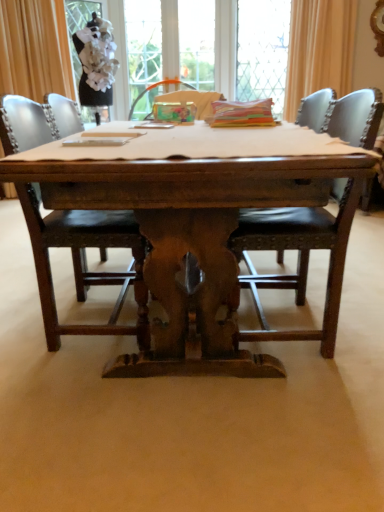
Question: Looking at their shapes, would you say dark brown wood chair at center, the first chair when ordered from left to right, is wider or thinner than leather cushioned chair at right, which appears as the 1th chair when viewed from the right?

Choices:
 (A) wide
 (B) thin

Answer: (A)

Question: Looking at the image, does dark brown wood chair at center, the first chair when ordered from left to right, seem bigger or smaller compared to leather cushioned chair at right, which appears as the 1th chair when viewed from the right?

Choices:
 (A) small
 (B) big

Answer: (B)

Question: Which object is the farthest from the wooden table at center?

Choices:
 (A) leather cushioned chair at right, the 2th chair in the left-to-right sequence
 (B) matte gold curtain at upper left, positioned as the 1th curtain in left-to-right order
 (C) smooth wooden table at center
 (D) white fabric screen door at upper left
 (E) orange fabric curtain at upper right, placed as the 1th curtain when sorted from right to left

Answer: (D)

Question: Which of these objects is positioned closest to the smooth wooden table at center?

Choices:
 (A) orange fabric curtain at upper right, the second curtain positioned from the left
 (B) wooden table at center
 (C) matte gold curtain at upper left, which ranks as the second curtain in right-to-left order
 (D) white fabric screen door at upper left
 (E) leather cushioned chair at right, which appears as the 1th chair when viewed from the right

Answer: (B)